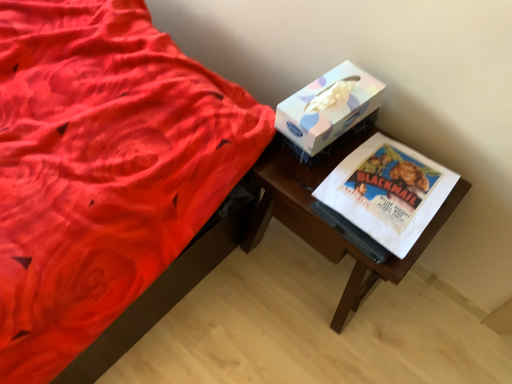
Question: Should I look upward or downward to see wooden table at right?

Choices:
 (A) down
 (B) up

Answer: (A)

Question: Is wooden table at right to the left of white paper at right from the viewer's perspective?

Choices:
 (A) no
 (B) yes

Answer: (B)

Question: Are wooden table at right and white paper at right making contact?

Choices:
 (A) no
 (B) yes

Answer: (A)

Question: Is wooden table at right looking in the opposite direction of white paper at right?

Choices:
 (A) yes
 (B) no

Answer: (B)

Question: From a real-world perspective, is wooden table at right located beneath white paper at right?

Choices:
 (A) no
 (B) yes

Answer: (B)

Question: Can you confirm if wooden table at right is bigger than white paper at right?

Choices:
 (A) no
 (B) yes

Answer: (B)

Question: Is wooden table at right shorter than white paper at right?

Choices:
 (A) no
 (B) yes

Answer: (A)

Question: Is wooden table at right at the left side of pastel paper tissue box at upper right?

Choices:
 (A) yes
 (B) no

Answer: (B)

Question: Is pastel paper tissue box at upper right at the back of wooden table at right?

Choices:
 (A) yes
 (B) no

Answer: (B)

Question: Is wooden table at right thinner than pastel paper tissue box at upper right?

Choices:
 (A) yes
 (B) no

Answer: (B)

Question: Would you say wooden table at right contains pastel paper tissue box at upper right?

Choices:
 (A) yes
 (B) no

Answer: (B)

Question: Is the depth of wooden table at right less than that of pastel paper tissue box at upper right?

Choices:
 (A) no
 (B) yes

Answer: (B)

Question: From a real-world perspective, is wooden table at right beneath pastel paper tissue box at upper right?

Choices:
 (A) yes
 (B) no

Answer: (A)

Question: Considering the relative sizes of white paper at right and wooden table at right in the image provided, is white paper at right wider than wooden table at right?

Choices:
 (A) yes
 (B) no

Answer: (B)